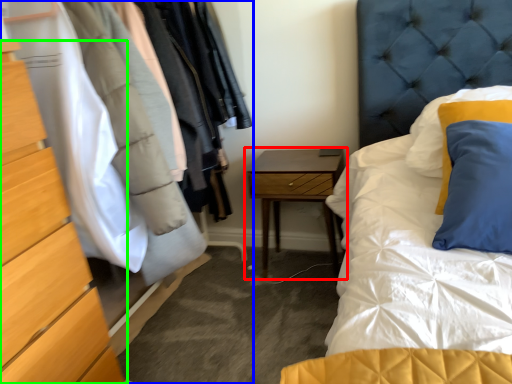
Question: Which is farther away from nightstand (highlighted by a red box)? dresser (highlighted by a blue box) or chest of drawers (highlighted by a green box)?

Choices:
 (A) dresser
 (B) chest of drawers

Answer: (B)